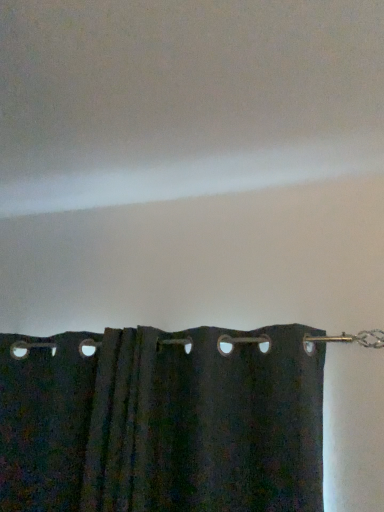
Measure the distance between point (129, 333) and camera.

Point (129, 333) and camera are 1.24 meters apart from each other.

The image size is (384, 512). What do you see at coordinates (162, 421) in the screenshot? I see `matte black curtain at lower center` at bounding box center [162, 421].

Locate an element on the screen. This screenshot has height=512, width=384. matte black curtain at lower center is located at coordinates (162, 421).

The width and height of the screenshot is (384, 512). I want to click on matte black curtain at lower center, so point(162,421).